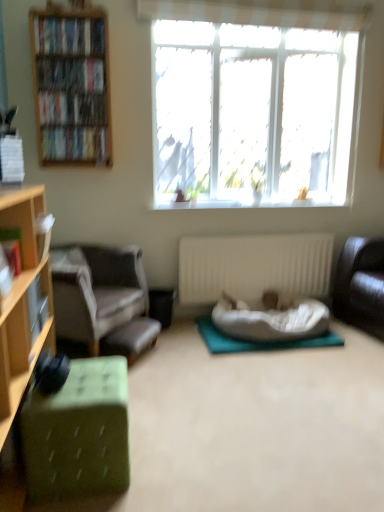
At what (x,y) coordinates should I click in order to perform the action: click on free space in front of teal fabric yoga mat at center. Please return your answer as a coordinate pair (x, y). The image size is (384, 512). Looking at the image, I should click on (276, 380).